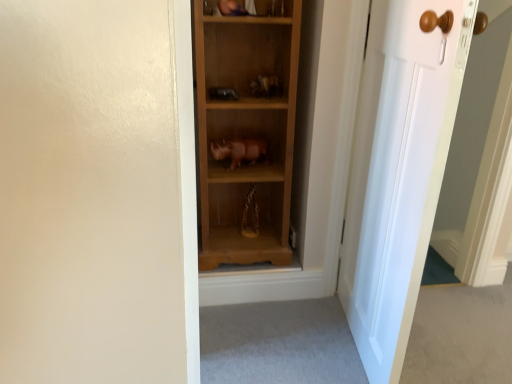
What do you see at coordinates (399, 170) in the screenshot?
I see `white wood door at right` at bounding box center [399, 170].

In order to face white wood door at right, should I rotate leftwards or rightwards?

To face it directly, rotate right by 16.454 degrees.

The height and width of the screenshot is (384, 512). Identify the location of white wood door at right. (399, 170).

The image size is (512, 384). In order to click on white wood door at right in this screenshot , I will do `click(399, 170)`.